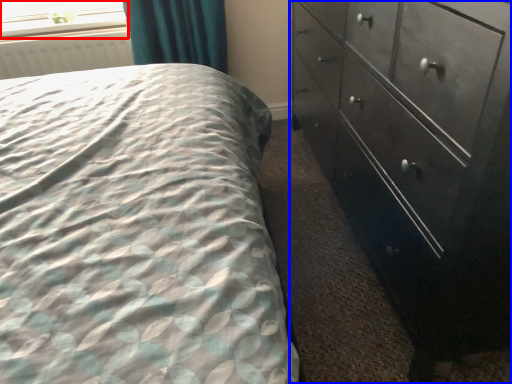
Question: Among these objects, which one is nearest to the camera, window screen (highlighted by a red box) or chest of drawers (highlighted by a blue box)?

Choices:
 (A) window screen
 (B) chest of drawers

Answer: (B)